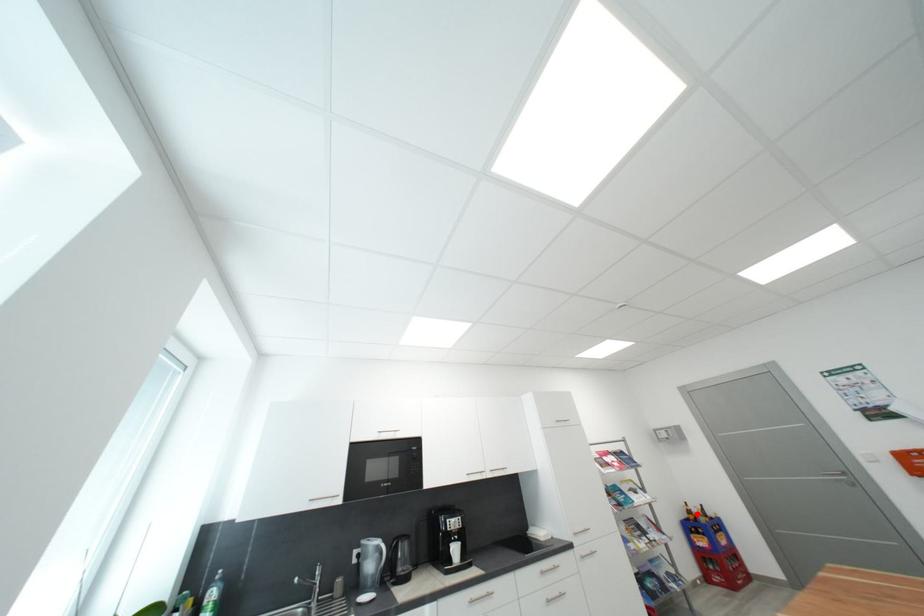
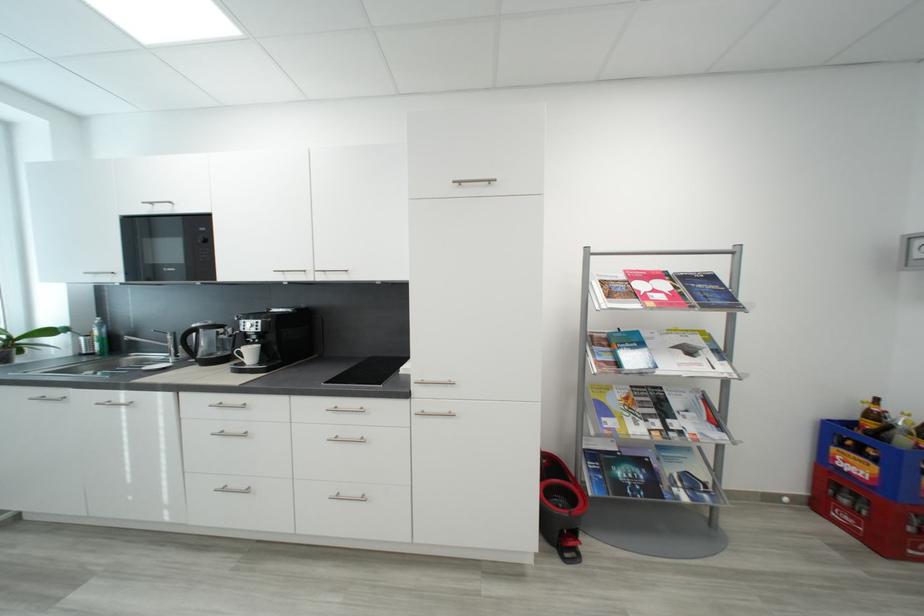
In the second image, find the point that corresponds to the highlighted location in the first image.

(881, 418)